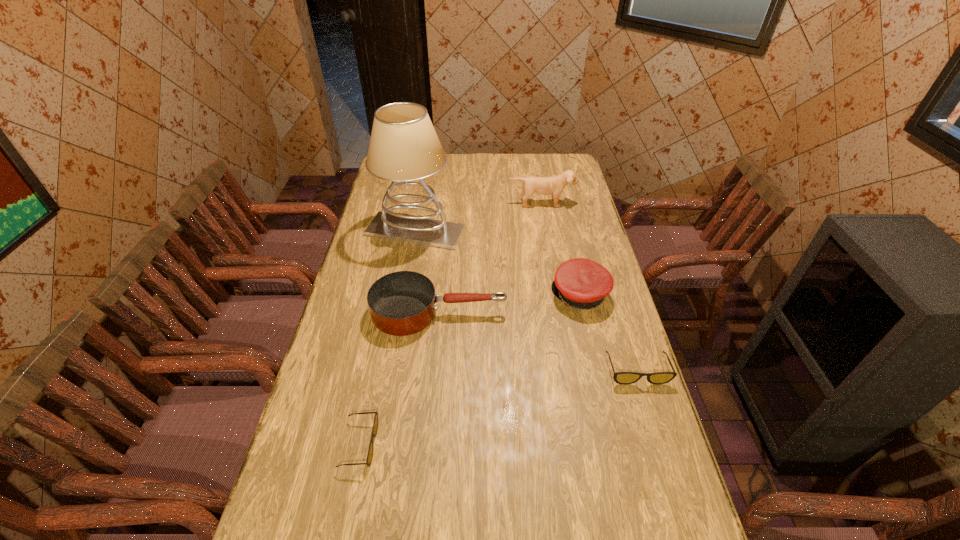
Where is `pan that is positioned at the left edge`? The height and width of the screenshot is (540, 960). pan that is positioned at the left edge is located at coordinates (402, 303).

Identify the location of sunglasses situated at the right edge. (625, 378).

Where is `puppy that is at the right edge`? The height and width of the screenshot is (540, 960). puppy that is at the right edge is located at coordinates (554, 185).

I want to click on cap positioned at the right edge, so click(x=581, y=283).

Image resolution: width=960 pixels, height=540 pixels. What are the coordinates of `vacant space at the far edge of the desktop` in the screenshot? It's located at (492, 156).

This screenshot has height=540, width=960. In order to click on free spot at the left edge of the desktop in this screenshot , I will do `click(381, 192)`.

You are a GUI agent. You are given a task and a screenshot of the screen. Output one action in this format:
    pyautogui.click(x=<x>, y=<y>)
    Task: Click on the free space at the right edge of the desktop
    
    Given the screenshot: What is the action you would take?
    click(x=609, y=342)

Find the location of a particular element. Image resolution: width=960 pixels, height=540 pixels. vacant space at the far right corner of the desktop is located at coordinates (541, 153).

Locate an element on the screen. This screenshot has width=960, height=540. free space between the farther sunglasses and the pan is located at coordinates 538,342.

Locate an element on the screen. Image resolution: width=960 pixels, height=540 pixels. free space that is in between the puppy and the second farthest object is located at coordinates (478, 218).